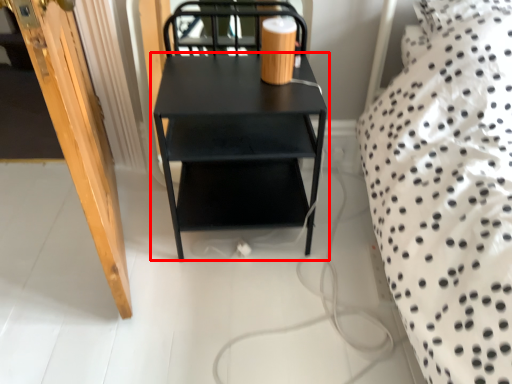
Question: In this image, where is table (annotated by the red box) located relative to door?

Choices:
 (A) left
 (B) right

Answer: (B)